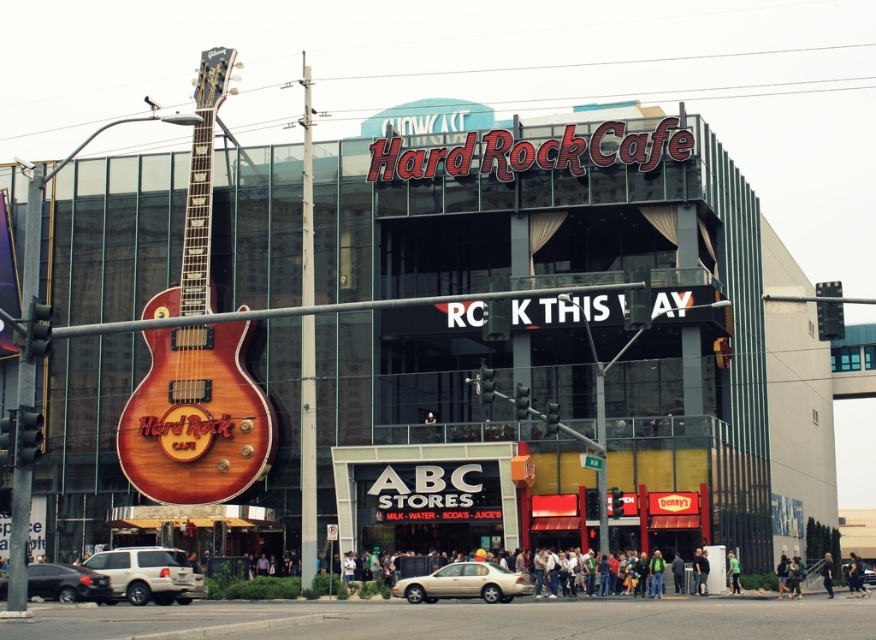
Question: Estimate the real-world distances between objects in this image. Which object is farther from the shiny black sedan at lower left?

Choices:
 (A) wooden guitar at left
 (B) silver metallic suv at lower left

Answer: (A)

Question: Which point is farther to the camera?

Choices:
 (A) wooden guitar at left
 (B) beige matte sedan at center
 (C) shiny black sedan at lower left
 (D) silver metallic suv at lower left

Answer: (B)

Question: Is wooden guitar at left to the right of silver metallic suv at lower left from the viewer's perspective?

Choices:
 (A) no
 (B) yes

Answer: (B)

Question: Does beige matte sedan at center have a smaller size compared to shiny black sedan at lower left?

Choices:
 (A) no
 (B) yes

Answer: (B)

Question: Does wooden guitar at left appear under silver metallic suv at lower left?

Choices:
 (A) yes
 (B) no

Answer: (B)

Question: Estimate the real-world distances between objects in this image. Which object is farther from the wooden guitar at left?

Choices:
 (A) beige matte sedan at center
 (B) silver metallic suv at lower left
 (C) shiny black sedan at lower left

Answer: (A)